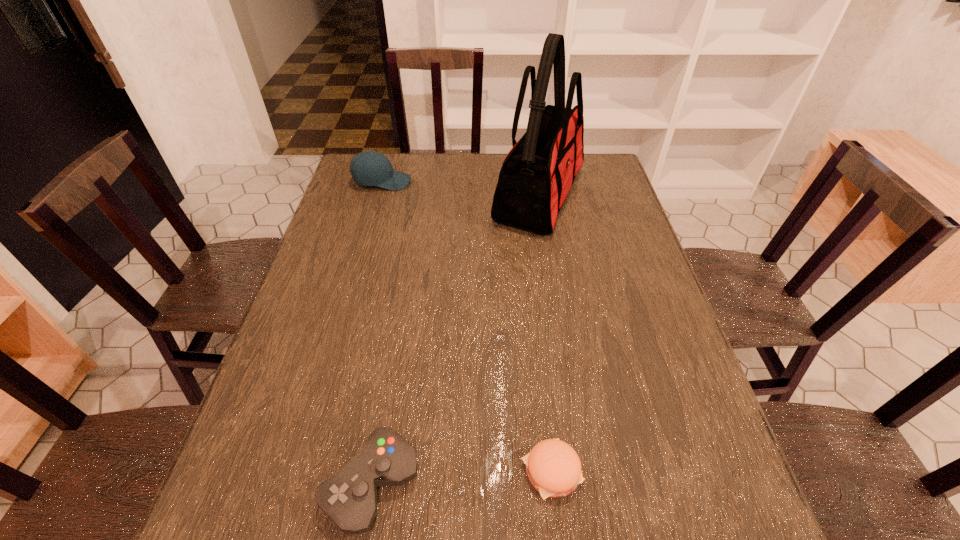
You are a GUI agent. You are given a task and a screenshot of the screen. Output one action in this format:
    pyautogui.click(x=<x>, y=<y>)
    Task: Click on the vacant area between the shortest object and the tallest object
    
    Given the screenshot: What is the action you would take?
    pyautogui.click(x=545, y=334)

Where is `vacant area that lies between the duffel bag and the second tallest object`? This screenshot has width=960, height=540. vacant area that lies between the duffel bag and the second tallest object is located at coordinates (461, 189).

At what (x,y) coordinates should I click in order to perform the action: click on vacant space in between the patty and the control. Please return your answer as a coordinate pair (x, y). Looking at the image, I should click on pos(462,477).

At what (x,y) coordinates should I click in order to perform the action: click on vacant area that lies between the shortest object and the tallest object. Please return your answer as a coordinate pair (x, y). This screenshot has width=960, height=540. Looking at the image, I should click on (545, 334).

Identify the location of free space between the duffel bag and the shortest object. This screenshot has width=960, height=540. (545, 334).

Locate an element on the screen. vacant space that is in between the baseball cap and the duffel bag is located at coordinates [461, 189].

The height and width of the screenshot is (540, 960). I want to click on free space that is in between the shortest object and the second shortest object, so click(462, 477).

Locate an element on the screen. The width and height of the screenshot is (960, 540). unoccupied position between the duffel bag and the baseball cap is located at coordinates (461, 189).

The image size is (960, 540). What are the coordinates of `free point between the tallest object and the patty` in the screenshot? It's located at (545, 334).

Where is `vacant area that lies between the patty and the control`? The width and height of the screenshot is (960, 540). vacant area that lies between the patty and the control is located at coordinates (462, 477).